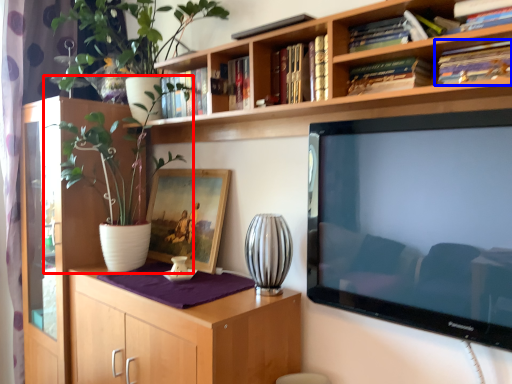
Question: Which object is further to the camera taking this photo, houseplant (highlighted by a red box) or book (highlighted by a blue box)?

Choices:
 (A) houseplant
 (B) book

Answer: (A)